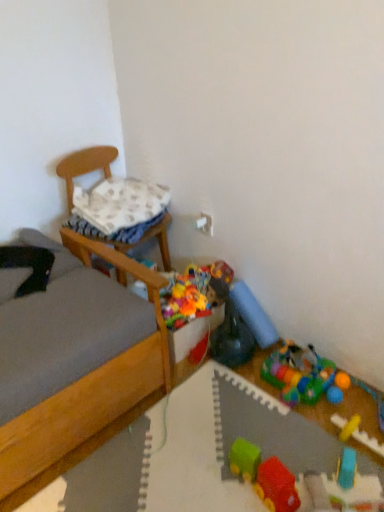
You are a GUI agent. You are given a task and a screenshot of the screen. Output one action in this format:
    pyautogui.click(x=<x>, y=<y>)
    Task: Click on the vacant point to the left of rubberized plastic play mat at lower right, the third toy viewed from the back
    This screenshot has width=384, height=512.
    Given the screenshot: What is the action you would take?
    pyautogui.click(x=261, y=391)